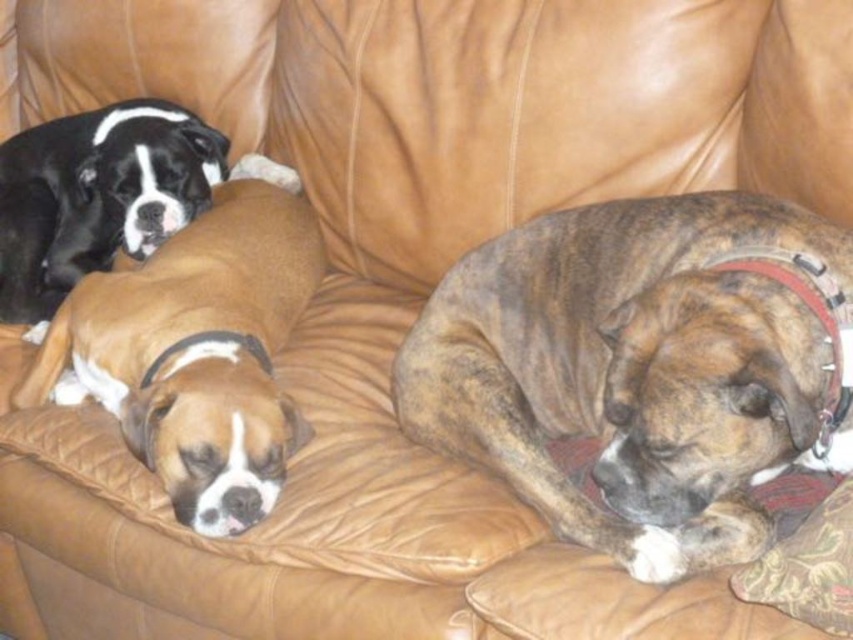
Is brown leather dog at center further to the viewer compared to black glossy dog at upper left?

No, brown leather dog at center is in front of black glossy dog at upper left.

Does brown leather dog at center have a larger size compared to black glossy dog at upper left?

Indeed, brown leather dog at center has a larger size compared to black glossy dog at upper left.

Between point (248, 228) and point (0, 310), which one is positioned behind?

Positioned behind is point (0, 310).

The image size is (853, 640). Identify the location of brown leather dog at center. (196, 348).

Which is more to the left, brown brindle dog at center or brown leather dog at center?

brown leather dog at center

Is brown brindle dog at center bigger than brown leather dog at center?

Actually, brown brindle dog at center might be smaller than brown leather dog at center.

Which is behind, point (556, 374) or point (189, 401)?

The point (556, 374) is behind.

I want to click on brown brindle dog at center, so click(645, 365).

Is brown brindle dog at center below black glossy dog at upper left?

Correct, brown brindle dog at center is located below black glossy dog at upper left.

Does brown brindle dog at center have a smaller size compared to black glossy dog at upper left?

Incorrect, brown brindle dog at center is not smaller in size than black glossy dog at upper left.

Describe the element at coordinates (645, 365) in the screenshot. I see `brown brindle dog at center` at that location.

The width and height of the screenshot is (853, 640). Find the location of `brown brindle dog at center`. brown brindle dog at center is located at coordinates (645, 365).